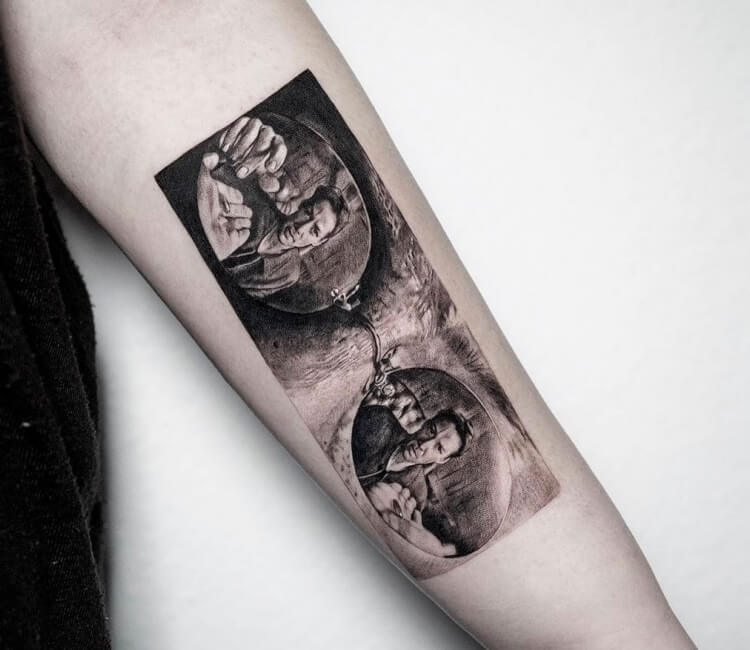
I want to click on wall, so click(495, 106).